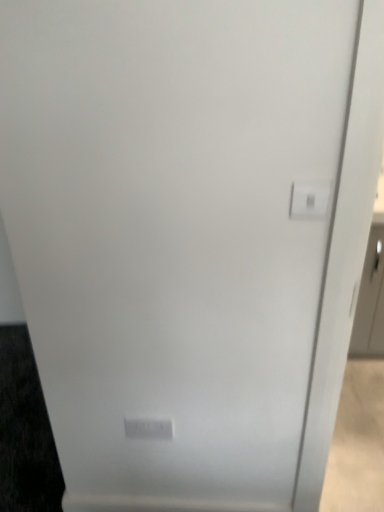
Question: Would you say white plastic light switch at upper right, the 1th light switch viewed from the top, is to the left or to the right of white plastic light switch at lower center, the 2th light switch positioned from the front, in the picture?

Choices:
 (A) right
 (B) left

Answer: (A)

Question: In terms of size, does white plastic light switch at upper right, marked as the 1th light switch in a right-to-left arrangement, appear bigger or smaller than white plastic light switch at lower center, the first light switch in the back-to-front sequence?

Choices:
 (A) small
 (B) big

Answer: (A)

Question: Is white plastic light switch at upper right, the first light switch viewed from the front, taller or shorter than white plastic light switch at lower center, arranged as the second light switch when viewed from the right?

Choices:
 (A) short
 (B) tall

Answer: (A)

Question: In terms of width, does white plastic light switch at lower center, the first light switch in the back-to-front sequence, look wider or thinner when compared to white plastic light switch at upper right, the 1th light switch viewed from the top?

Choices:
 (A) wide
 (B) thin

Answer: (B)

Question: Is point (135, 435) positioned closer to the camera than point (322, 200)?

Choices:
 (A) farther
 (B) closer

Answer: (A)

Question: Is white plastic light switch at lower center, arranged as the 1th light switch when viewed from the left, inside the boundaries of white plastic light switch at upper right, the 1th light switch viewed from the top, or outside?

Choices:
 (A) outside
 (B) inside

Answer: (A)

Question: Visually, is white plastic light switch at lower center, the 2th light switch positioned from the front, positioned to the left or to the right of white plastic light switch at upper right, the 1th light switch viewed from the top?

Choices:
 (A) left
 (B) right

Answer: (A)